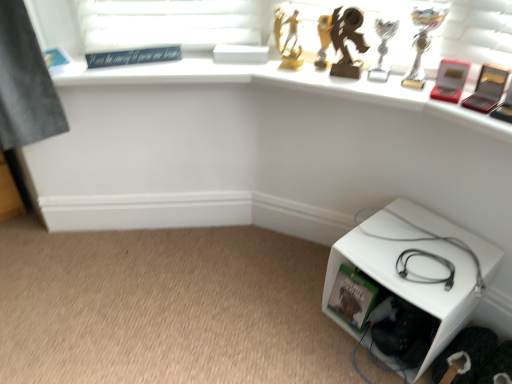
Question: Based on their positions, is white plastic cube at lower right located to the left or right of gray matte cable at lower right?

Choices:
 (A) right
 (B) left

Answer: (A)

Question: From their relative heights in the image, would you say white plastic cube at lower right is taller or shorter than gray matte cable at lower right?

Choices:
 (A) short
 (B) tall

Answer: (B)

Question: Is white plastic cube at lower right bigger or smaller than gray matte cable at lower right?

Choices:
 (A) small
 (B) big

Answer: (B)

Question: Is gray matte cable at lower right inside the boundaries of white plastic cube at lower right, or outside?

Choices:
 (A) inside
 (B) outside

Answer: (B)

Question: From a real-world perspective, is gray matte cable at lower right above or below white plastic cube at lower right?

Choices:
 (A) below
 (B) above

Answer: (B)

Question: Based on their sizes in the image, would you say gray matte cable at lower right is bigger or smaller than white plastic cube at lower right?

Choices:
 (A) big
 (B) small

Answer: (B)

Question: In terms of height, does gray matte cable at lower right look taller or shorter compared to white plastic cube at lower right?

Choices:
 (A) short
 (B) tall

Answer: (A)